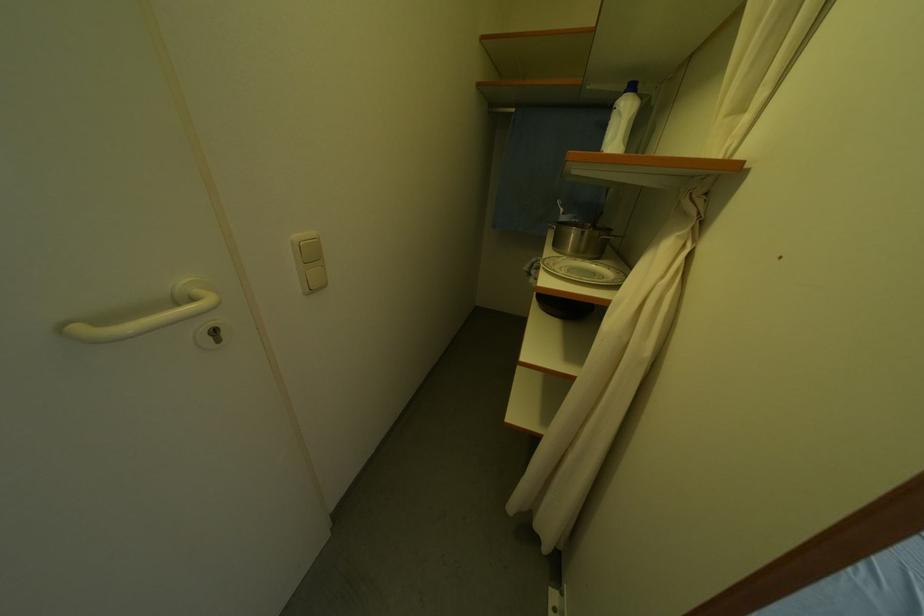
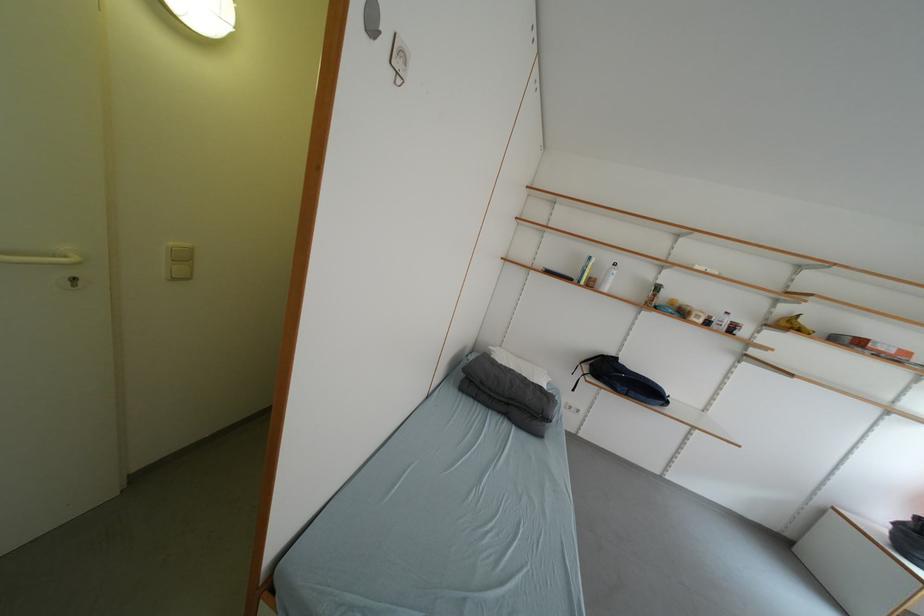
In the second image, find the point that corresponds to [321,259] in the first image.

(191, 261)